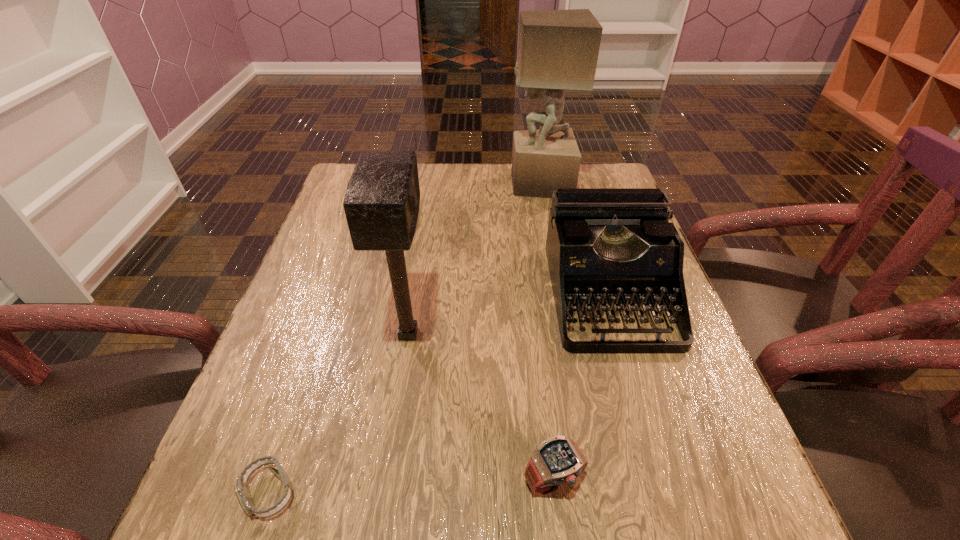
The image size is (960, 540). Find the location of `the farthest object`. the farthest object is located at coordinates (558, 50).

Where is `sculpture`? The image size is (960, 540). sculpture is located at coordinates (558, 50).

The height and width of the screenshot is (540, 960). I want to click on mallet, so click(381, 204).

Where is `the fourth shortest object`? the fourth shortest object is located at coordinates (381, 204).

Find the location of a particular element. The height and width of the screenshot is (540, 960). typewriter is located at coordinates (605, 246).

Image resolution: width=960 pixels, height=540 pixels. I want to click on the right watch, so click(557, 460).

Where is `the fourth tallest object`? the fourth tallest object is located at coordinates (557, 460).

Locate an element on the screen. the shorter watch is located at coordinates (241, 489).

Where is `the leftmost object`? the leftmost object is located at coordinates (x=241, y=489).

Identify the location of free space located 0.080m on the front-facing side of the tallest object. The width and height of the screenshot is (960, 540). (483, 184).